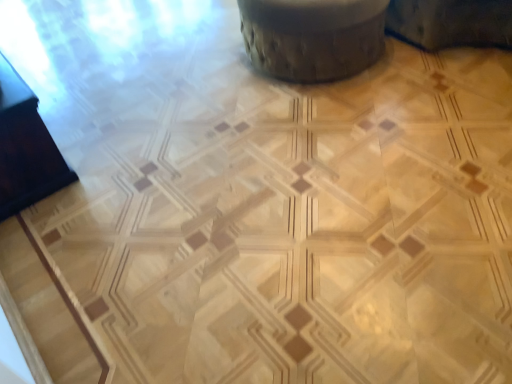
Question: Considering the positions of point (29, 112) and point (317, 1), is point (29, 112) closer or farther from the camera than point (317, 1)?

Choices:
 (A) farther
 (B) closer

Answer: (B)

Question: Is black glossy drawer at left bigger or smaller than wooden textured swivel chair at upper center?

Choices:
 (A) small
 (B) big

Answer: (A)

Question: Is black glossy drawer at left inside or outside of wooden textured swivel chair at upper center?

Choices:
 (A) inside
 (B) outside

Answer: (B)

Question: Considering the positions of wooden textured swivel chair at upper center and black glossy drawer at left in the image, is wooden textured swivel chair at upper center bigger or smaller than black glossy drawer at left?

Choices:
 (A) small
 (B) big

Answer: (B)

Question: From their relative heights in the image, would you say wooden textured swivel chair at upper center is taller or shorter than black glossy drawer at left?

Choices:
 (A) tall
 (B) short

Answer: (A)

Question: Is wooden textured swivel chair at upper center wider or thinner than black glossy drawer at left?

Choices:
 (A) thin
 (B) wide

Answer: (B)

Question: Is point (344, 44) closer or farther from the camera than point (3, 218)?

Choices:
 (A) farther
 (B) closer

Answer: (A)